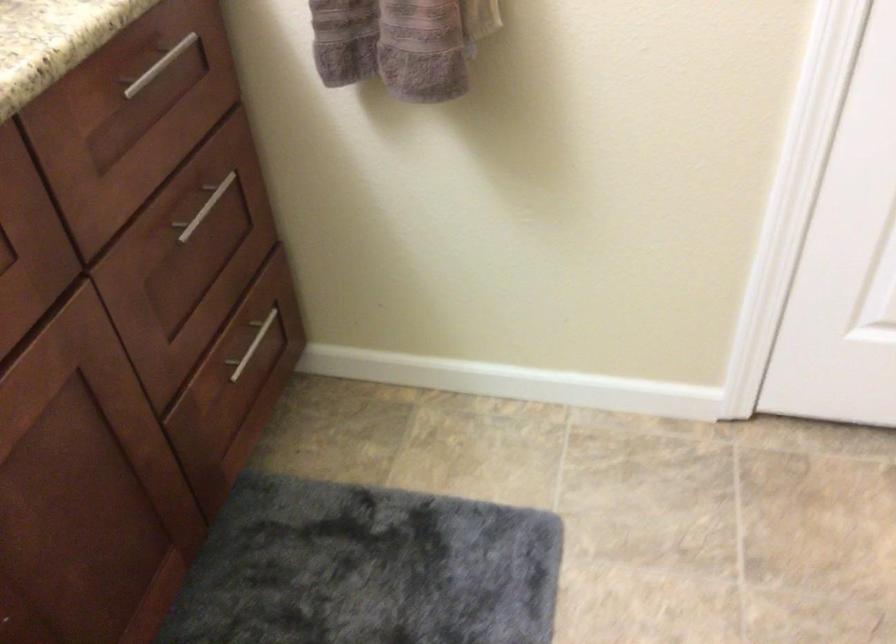
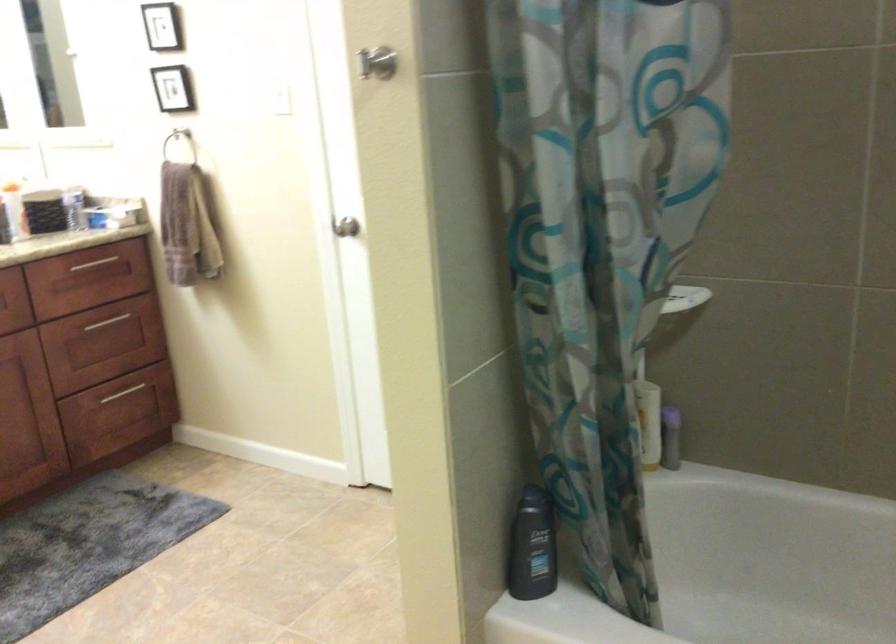
In the second image, find the point that corresponds to point 259,361 in the first image.

(122, 393)